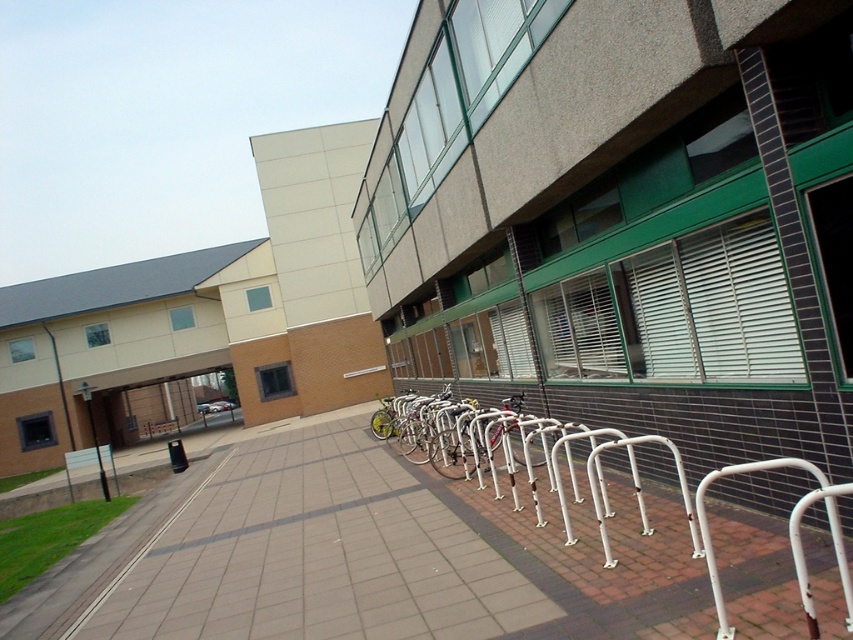
Question: Estimate the real-world distances between objects in this image. Which object is farther from the smooth concrete sidewalk at lower left?

Choices:
 (A) silver metallic bicycle at center
 (B) white metal bike rack at lower center

Answer: (B)

Question: Considering the real-world distances, which object is farthest from the silver metallic bicycle at center?

Choices:
 (A) smooth concrete sidewalk at lower left
 (B) white metal bike rack at lower center

Answer: (B)

Question: Which point appears closest to the camera in this image?

Choices:
 (A) (397, 413)
 (B) (738, 604)
 (C) (128, 566)

Answer: (B)

Question: Does white metal bike rack at lower center have a lesser width compared to smooth concrete sidewalk at lower left?

Choices:
 (A) yes
 (B) no

Answer: (A)

Question: Does white metal bike rack at lower center have a lesser width compared to silver metallic bicycle at center?

Choices:
 (A) no
 (B) yes

Answer: (B)

Question: Can you confirm if smooth concrete sidewalk at lower left is bigger than silver metallic bicycle at center?

Choices:
 (A) yes
 (B) no

Answer: (B)